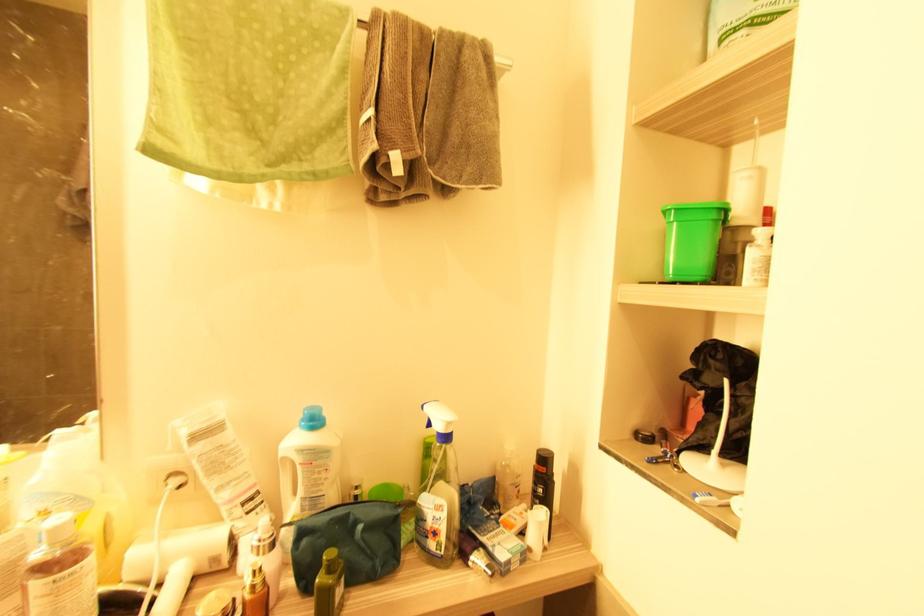
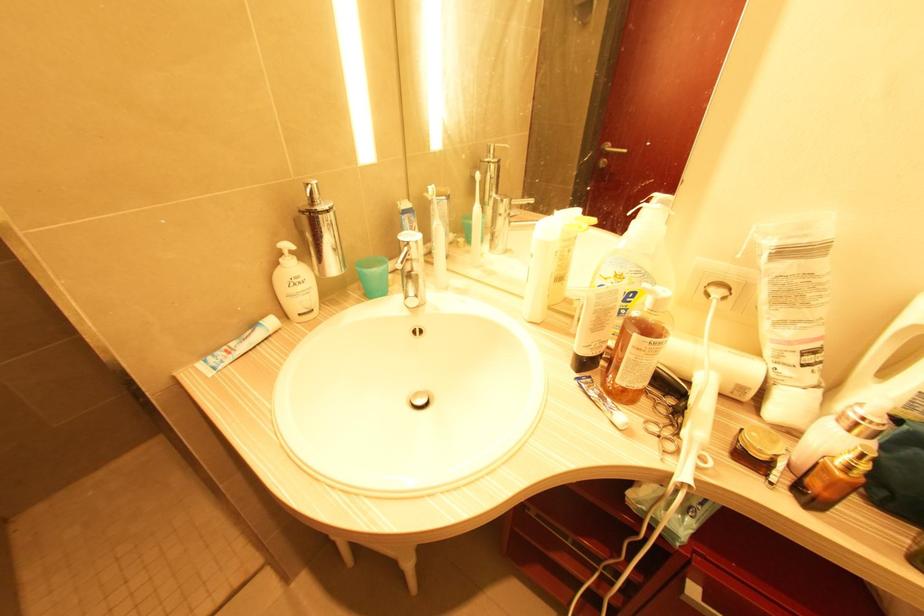
How did the camera likely rotate?

The rotation direction of the camera is left-down.